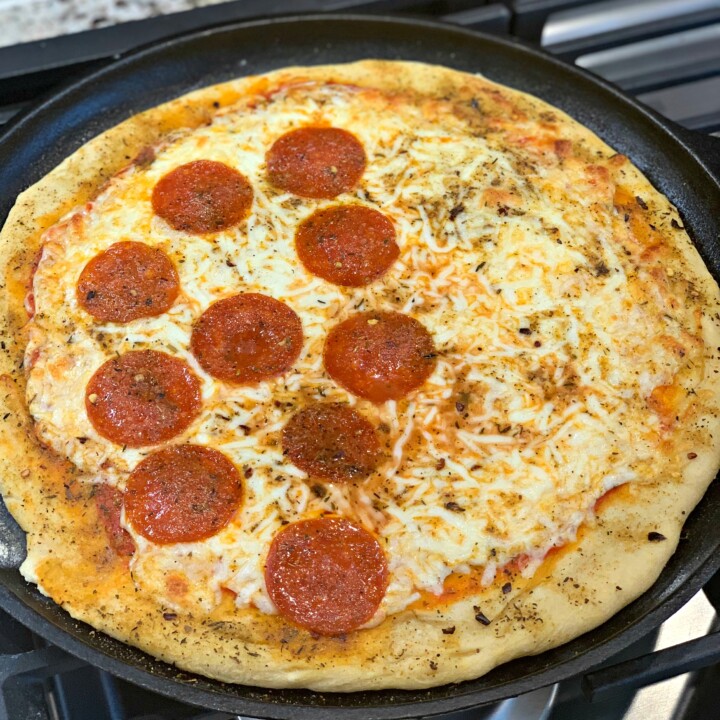
This screenshot has width=720, height=720. I want to click on metal drawer, so click(636, 22).